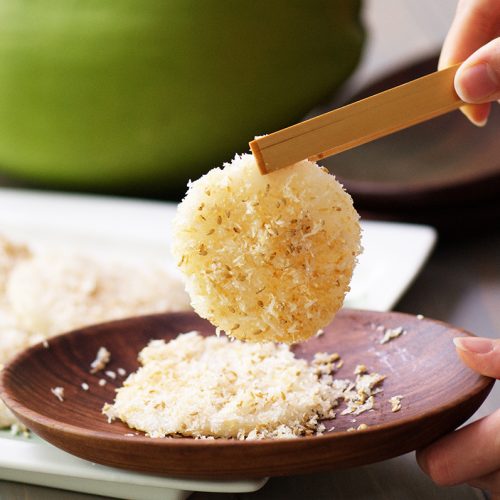
The height and width of the screenshot is (500, 500). Identify the location of chopstick. (355, 116).